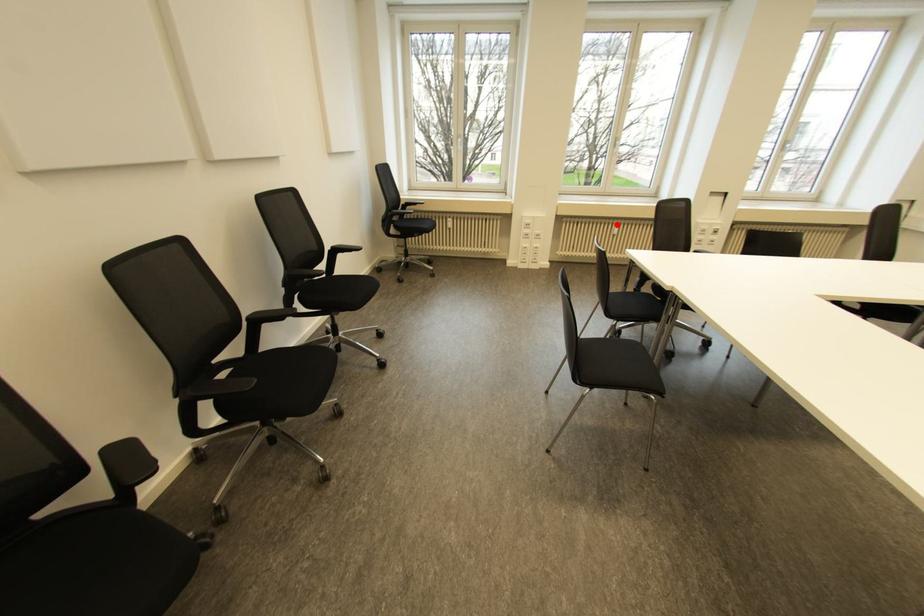
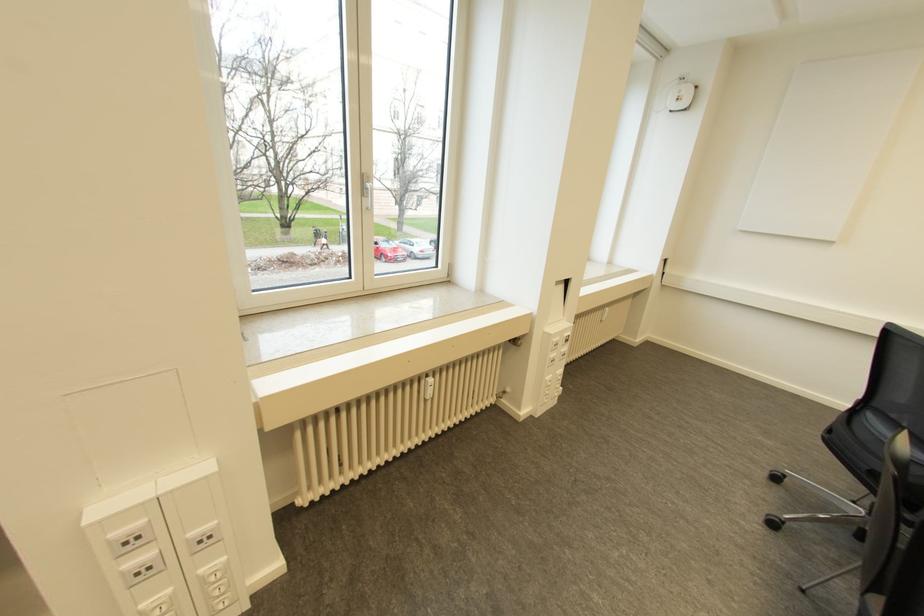
Where in the second image is the point corresponding to the highlighted location from the first image?

(430, 379)